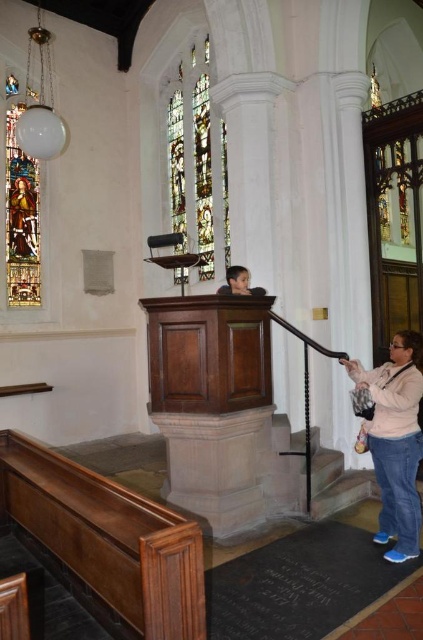
Question: Considering the relative positions of pink fabric at lower right and stained glass window at upper left in the image provided, where is pink fabric at lower right located with respect to stained glass window at upper left?

Choices:
 (A) left
 (B) right

Answer: (B)

Question: Is stained glass window at upper center thinner than stained glass window at upper left?

Choices:
 (A) no
 (B) yes

Answer: (A)

Question: Which of the following is the farthest from the observer?

Choices:
 (A) (412, 520)
 (B) (216, 129)
 (C) (13, 250)

Answer: (B)

Question: Which object is closer to the camera taking this photo?

Choices:
 (A) stained glass window at upper left
 (B) stained glass window at upper center
 (C) pink fabric at lower right

Answer: (C)

Question: Which of the following is the farthest from the observer?

Choices:
 (A) (189, 84)
 (B) (18, 196)
 (C) (392, 472)

Answer: (A)

Question: Where is pink fabric at lower right located in relation to stained glass window at upper left in the image?

Choices:
 (A) right
 (B) left

Answer: (A)